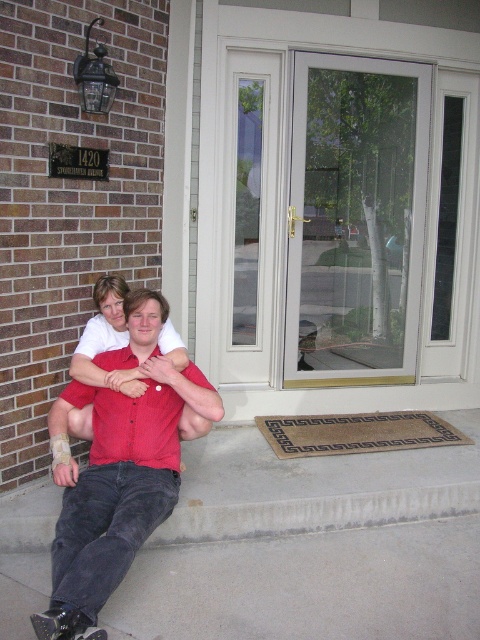
You are standing on the sidewalk in front of the house and want to see both the red cotton shirt at center and the black rubber skateboard at lower left. Which object will appear larger to you?

The red cotton shirt at center will appear larger because it is much taller than the black rubber skateboard at lower left.

What is the color of the shirt at the coordinates point (120,461)?

The point (120,461) is on the red cotton shirt at center, so the color is red.

You are designing a layout for a photo shoot and need to ensure that the two red shirts are positioned at a specific distance. Given that the minimum required distance between the red cotton shirt at center and the matte red shirt at center is 3 inches, will the current arrangement meet the requirement?

The red cotton shirt at center and the matte red shirt at center are currently 2.93 inches apart, which is slightly less than the required 3 inches. Therefore, the current arrangement does not meet the specified distance requirement.